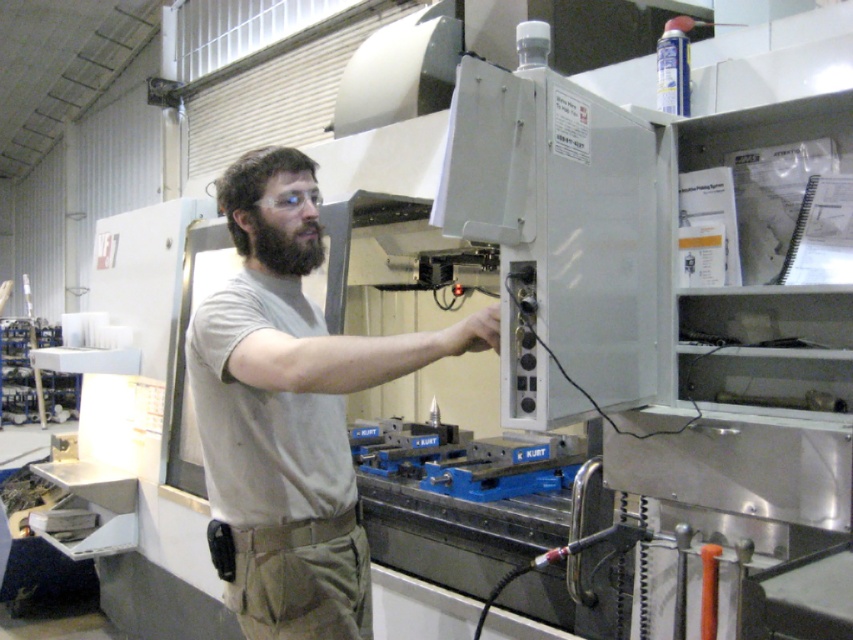
You are an inspector checking the safety gear of workers in the workshop. You notice the light gray shirt at center and the black fuzzy beard at center. Which one has a greater width?

The light gray shirt at center has a greater width than the black fuzzy beard at center.

You are an observer in the workshop. You notice the light gray shirt at center and the black fuzzy beard at center. Which one is closer to you?

The light gray shirt at center is closer to you because it is in front of the black fuzzy beard at center.

You are an observer in the workshop. You notice a man in a light gray shirt at center and a black fuzzy beard at center. Which object is more to the right?

The light gray shirt at center is positioned on the right side of black fuzzy beard at center, so the light gray shirt at center is more to the right.